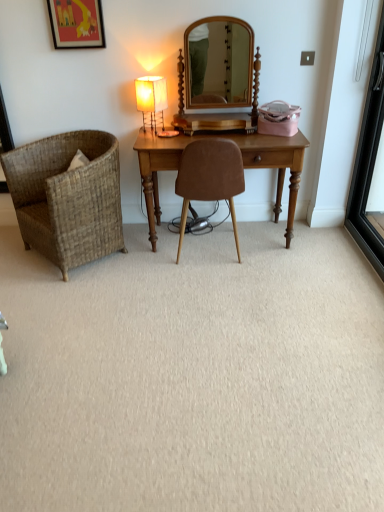
Question: Is woven brown chair at left, arranged as the second chair when viewed from the right, shorter than matte black picture frame at upper left?

Choices:
 (A) yes
 (B) no

Answer: (B)

Question: Would you say woven brown chair at left, arranged as the second chair when viewed from the right, is outside matte black picture frame at upper left?

Choices:
 (A) yes
 (B) no

Answer: (A)

Question: Is woven brown chair at left, arranged as the second chair when viewed from the right, directly adjacent to matte black picture frame at upper left?

Choices:
 (A) no
 (B) yes

Answer: (A)

Question: From the image's perspective, is woven brown chair at left, marked as the 1th chair in a left-to-right arrangement, located beneath matte black picture frame at upper left?

Choices:
 (A) yes
 (B) no

Answer: (A)

Question: Is woven brown chair at left, arranged as the second chair when viewed from the right, looking in the opposite direction of matte black picture frame at upper left?

Choices:
 (A) yes
 (B) no

Answer: (B)

Question: Is woven brown chair at left, marked as the 1th chair in a left-to-right arrangement, aimed at matte black picture frame at upper left?

Choices:
 (A) no
 (B) yes

Answer: (A)

Question: Does woven brown chair at left, marked as the 1th chair in a left-to-right arrangement, have a greater height compared to brown suede chair at center, marked as the first chair in a right-to-left arrangement?

Choices:
 (A) no
 (B) yes

Answer: (A)

Question: Considering the relative sizes of woven brown chair at left, arranged as the second chair when viewed from the right, and brown suede chair at center, marked as the first chair in a right-to-left arrangement, in the image provided, is woven brown chair at left, arranged as the second chair when viewed from the right, smaller than brown suede chair at center, marked as the first chair in a right-to-left arrangement,?

Choices:
 (A) yes
 (B) no

Answer: (B)

Question: Can you confirm if woven brown chair at left, arranged as the second chair when viewed from the right, is shorter than brown suede chair at center, which is counted as the 2th chair, starting from the left?

Choices:
 (A) no
 (B) yes

Answer: (B)

Question: Is brown suede chair at center, marked as the first chair in a right-to-left arrangement, at the back of woven brown chair at left, arranged as the second chair when viewed from the right?

Choices:
 (A) yes
 (B) no

Answer: (B)

Question: From the image's perspective, would you say woven brown chair at left, marked as the 1th chair in a left-to-right arrangement, is positioned over brown suede chair at center, which is counted as the 2th chair, starting from the left?

Choices:
 (A) no
 (B) yes

Answer: (A)

Question: Is woven brown chair at left, arranged as the second chair when viewed from the right, bigger than brown suede chair at center, which is counted as the 2th chair, starting from the left?

Choices:
 (A) yes
 (B) no

Answer: (A)

Question: Does matte fabric table lamp at center lie behind black glass screen door at right?

Choices:
 (A) no
 (B) yes

Answer: (B)